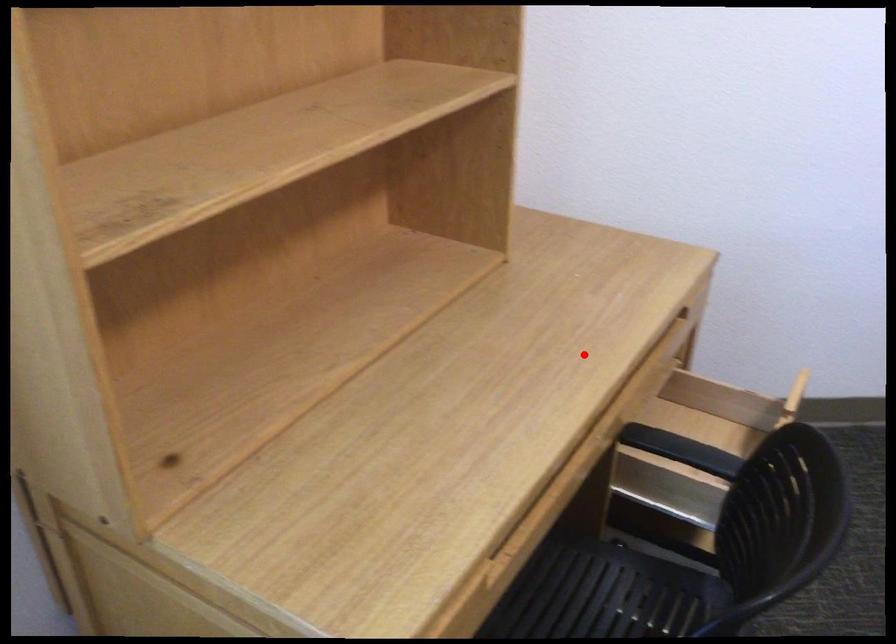
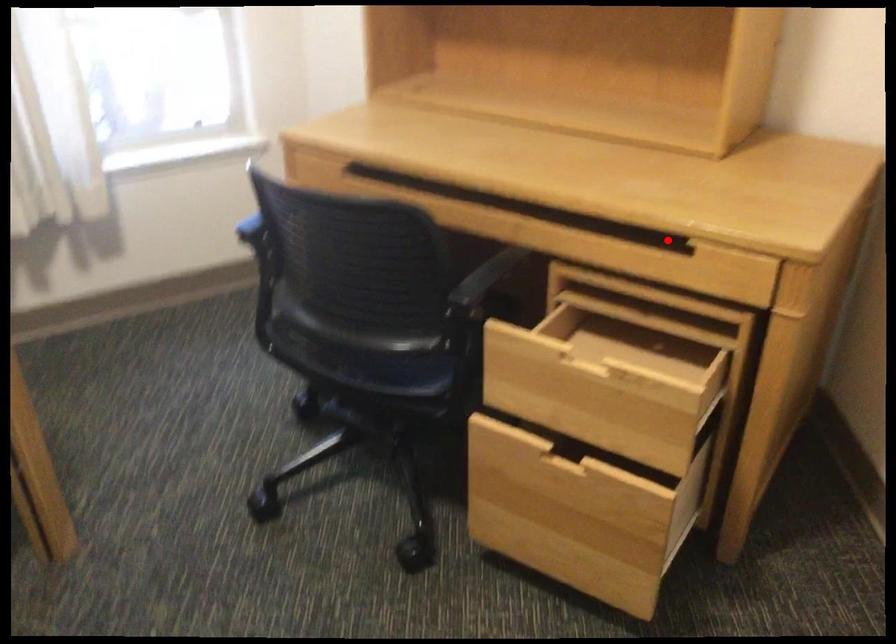
In the scene shown: I am providing you with two images of the same scene from different viewpoints. A red point is marked on the first image and another point is marked on the second image. Is the marked point in image1 the same physical position as the marked point in image2?

Yes